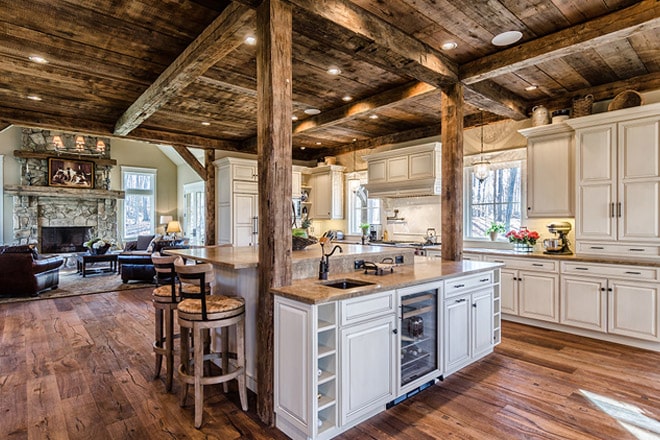
You are a GUI agent. You are given a task and a screenshot of the screen. Output one action in this format:
    pyautogui.click(x=<x>, y=<y>)
    Task: Click on the sinks
    The height and width of the screenshot is (440, 660).
    Given the screenshot: What is the action you would take?
    pyautogui.click(x=350, y=282), pyautogui.click(x=424, y=244)